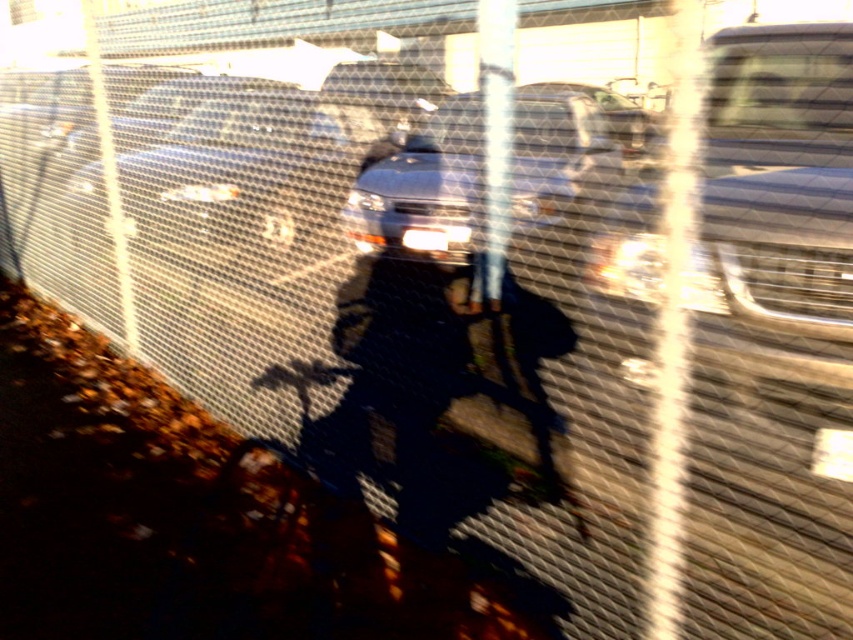
You are a delivery person who needs to pick up a metallic silver bicycle at center from the scene. The fence in front of you is 7 feet tall. Can you reach the bicycle without climbing over the fence?

The metallic silver bicycle at center is 6.99 feet away from the camera, which is just under the fence height of 7 feet. Since the distance to the bicycle is less than the fence height, you can likely reach it by leaning over the fence without needing to climb over it completely.

You are a photographer trying to capture a clear shot of the metallic silver bicycle at center and the metallic silver car at center through the fence. Since the fence has a pattern that might interfere with the photo, which object should you focus on first to ensure it appears sharp in the final image?

You should focus on the metallic silver bicycle at center first because it is closer to the viewer than the metallic silver car at center, so focusing on it will ensure it appears sharp while the car may be slightly blurred due to the distance and fence interference.

You are a delivery person trying to decide whether to ride the metallic silver bicycle at center or drive the satin silver sedan at center through a narrow alley. Based on the scene, which vehicle would you choose and why?

The metallic silver bicycle at center is thinner than the satin silver sedan at center, so the bicycle would be easier to maneuver through the narrow alley.